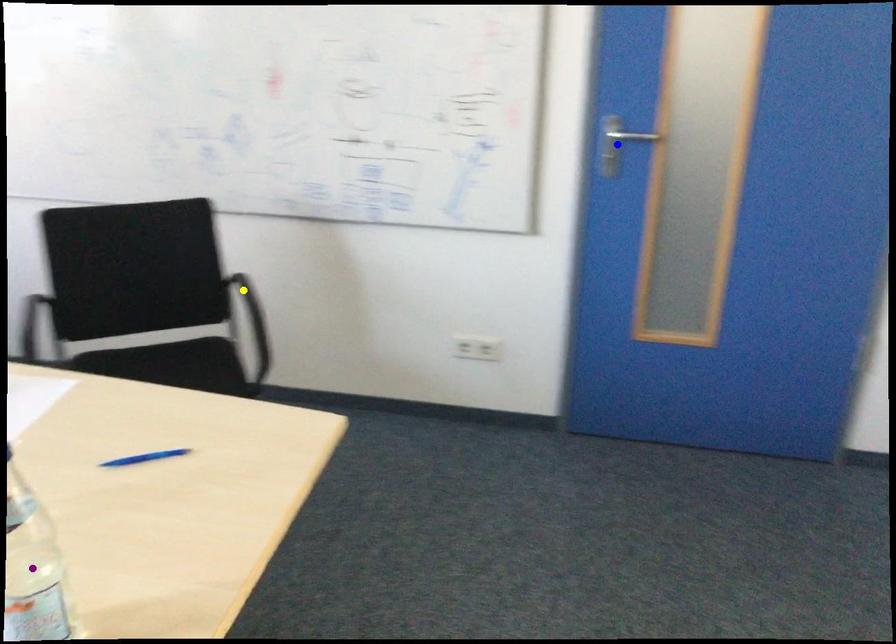
Order these from nearest to farthest:
- blue point
- yellow point
- purple point

1. purple point
2. blue point
3. yellow point